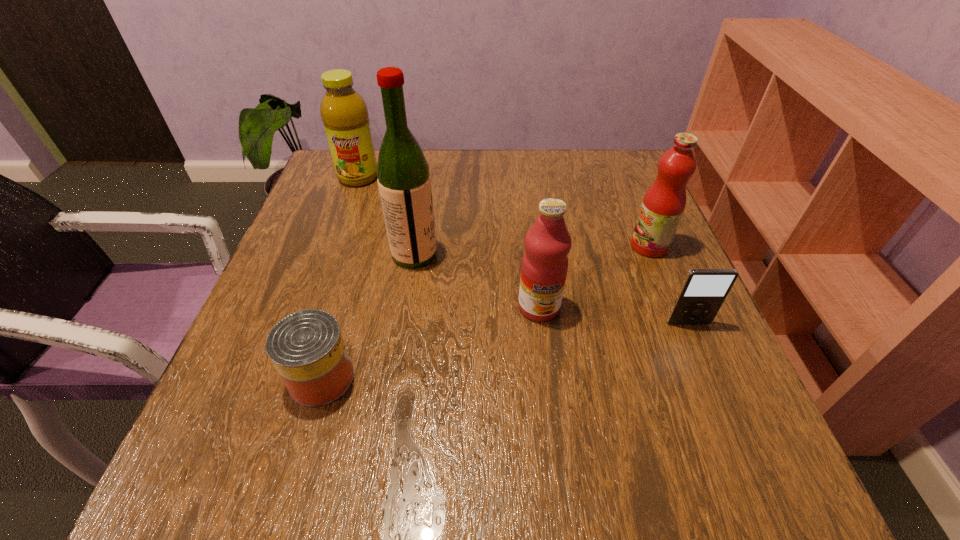
At what (x,y) coordinates should I click in order to perform the action: click on the third object from left to right. Please return your answer as a coordinate pair (x, y). This screenshot has height=540, width=960. Looking at the image, I should click on (x=404, y=181).

I want to click on the tallest object, so click(x=404, y=181).

Find the location of a particular element. This screenshot has height=540, width=960. the leftmost fruit juice is located at coordinates (344, 113).

Find the location of a particular element. Image resolution: width=960 pixels, height=540 pixels. the farthest fruit juice is located at coordinates (344, 113).

Find the location of `the second farthest fruit juice`. the second farthest fruit juice is located at coordinates (663, 205).

Image resolution: width=960 pixels, height=540 pixels. I want to click on the nearest fruit juice, so click(544, 267).

Where is `the fourth object from left to right`? The height and width of the screenshot is (540, 960). the fourth object from left to right is located at coordinates (544, 267).

Where is `iPod`? This screenshot has height=540, width=960. iPod is located at coordinates tap(703, 291).

Identify the location of can. 307,349.

The width and height of the screenshot is (960, 540). I want to click on the shortest object, so click(307, 349).